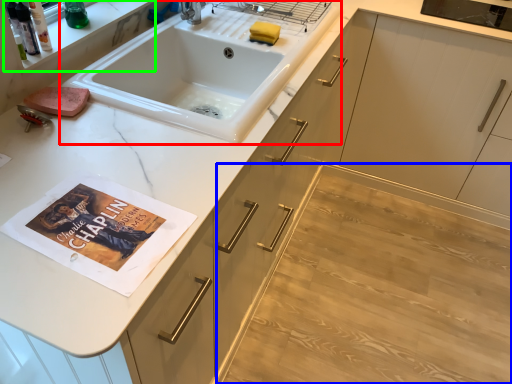
Question: Which object is positioned farthest from sink (highlighted by a red box)? Select from plain (highlighted by a blue box) and shelf (highlighted by a green box).

Choices:
 (A) plain
 (B) shelf

Answer: (A)